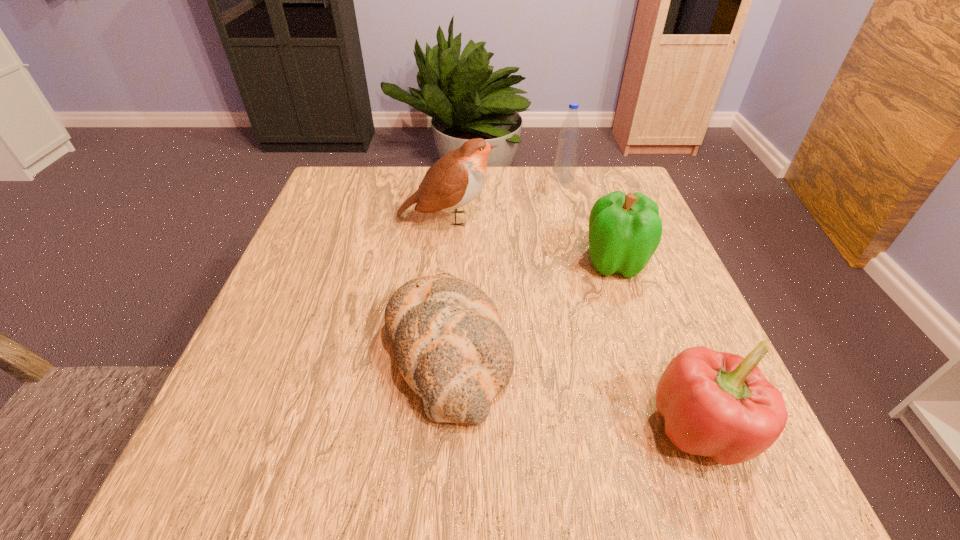
I want to click on object that is the fourth closest to the farther bell pepper, so click(x=566, y=157).

Select which object is the second closest to the bird. Please provide its 2D coordinates. Your answer should be formatted as a tuple, i.e. [(x, y)], where the tuple contains the x and y coordinates of a point satisfying the conditions above.

[(625, 230)]

You are a GUI agent. You are given a task and a screenshot of the screen. Output one action in this format:
    pyautogui.click(x=<x>, y=<y>)
    Task: Click on the vacant region that satisfies the following two spatial constraints: 1. at the face of the second farthest object; 2. on the back side of the nearer bell pepper
    
    Given the screenshot: What is the action you would take?
    pyautogui.click(x=427, y=429)

The height and width of the screenshot is (540, 960). In order to click on vacant space that satisfies the following two spatial constraints: 1. at the face of the third nearest object; 2. on the left side of the bird in this screenshot , I will do `click(443, 262)`.

Image resolution: width=960 pixels, height=540 pixels. In order to click on vacant space that satisfies the following two spatial constraints: 1. on the back side of the water bottle; 2. on the left side of the shortest object in this screenshot , I will do `click(460, 178)`.

At what (x,y) coordinates should I click in order to perform the action: click on vacant space that satisfies the following two spatial constraints: 1. on the front side of the water bottle; 2. at the face of the bird. Please return your answer as a coordinate pair (x, y). Image resolution: width=960 pixels, height=540 pixels. Looking at the image, I should click on (574, 219).

Image resolution: width=960 pixels, height=540 pixels. In order to click on vacant position in the image that satisfies the following two spatial constraints: 1. on the back side of the nearer bell pepper; 2. at the face of the bird in this screenshot , I will do `click(618, 219)`.